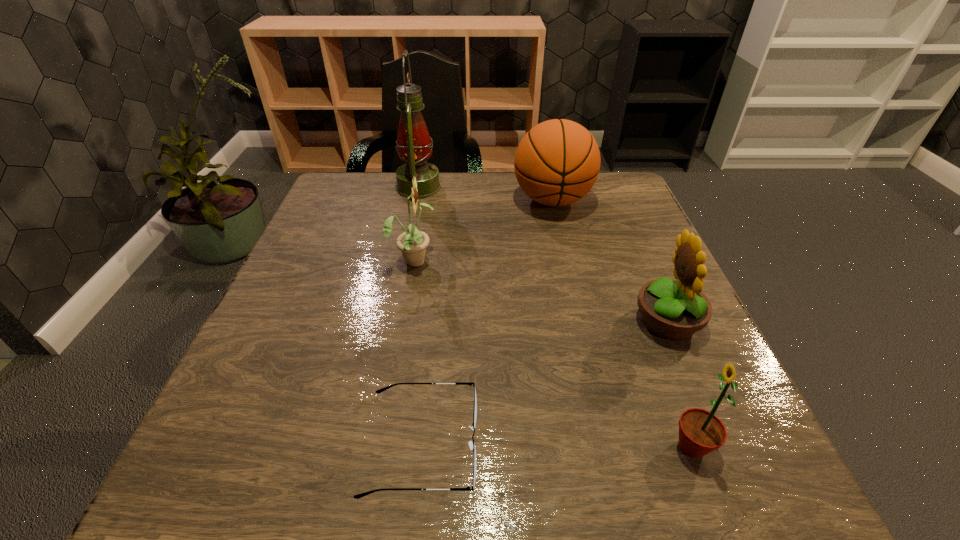
This screenshot has height=540, width=960. What are the coordinates of `the tallest object` in the screenshot? It's located at (413, 145).

Locate an element on the screen. Image resolution: width=960 pixels, height=540 pixels. basketball is located at coordinates (557, 162).

Where is `the farthest sunflower`? The height and width of the screenshot is (540, 960). the farthest sunflower is located at coordinates coord(413,243).

You are a GUI agent. You are given a task and a screenshot of the screen. Output one action in this format:
    pyautogui.click(x=<x>, y=<y>)
    Task: Click on the leftmost sunflower
    
    Given the screenshot: What is the action you would take?
    pyautogui.click(x=413, y=243)

Locate an element on the screen. the second farthest sunflower is located at coordinates (674, 310).

Locate an element on the screen. This screenshot has height=540, width=960. the nearest sunflower is located at coordinates (700, 432).

Identify the location of the shortest object. (472, 445).

I want to click on free point located 0.140m on the left of the oil lamp, so click(x=345, y=188).

Identify the location of vacant space located on the left of the basketball. This screenshot has height=540, width=960. (413, 200).

Where is `vacant space located on the front-facing side of the third farthest object`? This screenshot has width=960, height=540. vacant space located on the front-facing side of the third farthest object is located at coordinates (564, 260).